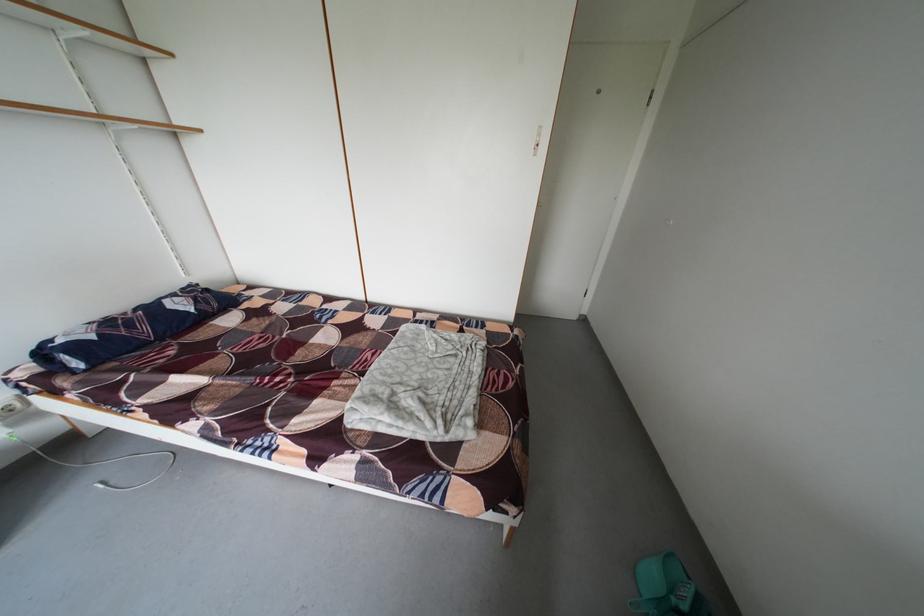
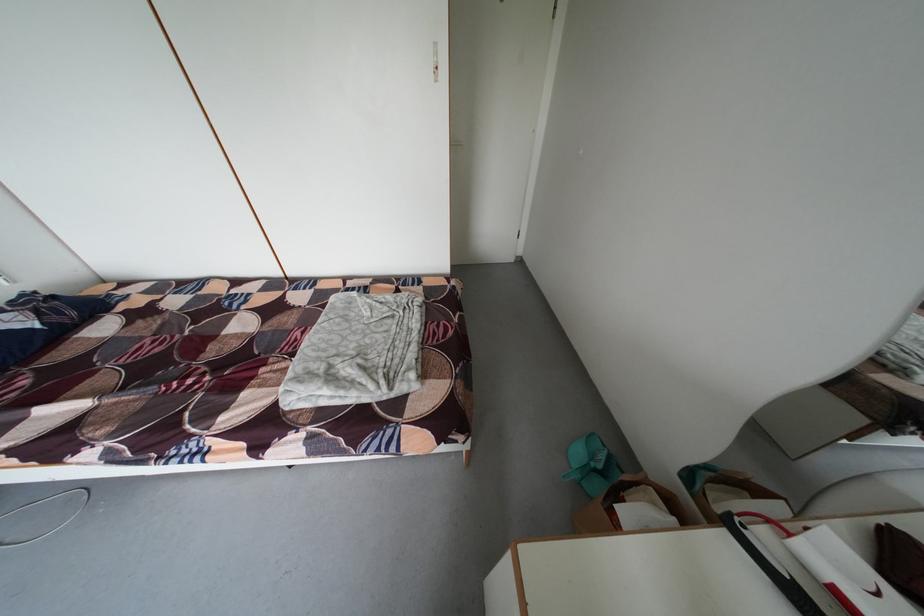
The point at (380, 360) is marked in the first image. Where is the corresponding point in the second image?

(309, 339)